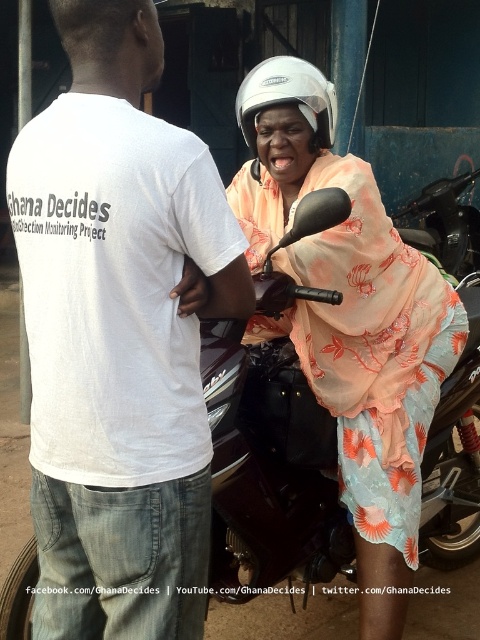
Does floral fabric helmet at upper center have a lesser width compared to white matte helmet at upper center?

In fact, floral fabric helmet at upper center might be wider than white matte helmet at upper center.

The height and width of the screenshot is (640, 480). I want to click on floral fabric helmet at upper center, so click(348, 308).

Where is `floral fabric helmet at upper center`? This screenshot has width=480, height=640. floral fabric helmet at upper center is located at coordinates [348, 308].

The width and height of the screenshot is (480, 640). I want to click on floral fabric helmet at upper center, so click(348, 308).

Who is taller, floral fabric helmet at upper center or shiny dark brown motorcycle at center?

floral fabric helmet at upper center

Is floral fabric helmet at upper center shorter than shiny dark brown motorcycle at center?

Incorrect, floral fabric helmet at upper center's height does not fall short of shiny dark brown motorcycle at center's.

Who is more forward, (259, 257) or (286, 458)?

Point (259, 257) is more forward.

The height and width of the screenshot is (640, 480). I want to click on floral fabric helmet at upper center, so click(348, 308).

Does white cotton shirt at center have a lesser width compared to white matte helmet at upper center?

No, white cotton shirt at center is not thinner than white matte helmet at upper center.

You are a GUI agent. You are given a task and a screenshot of the screen. Output one action in this format:
    pyautogui.click(x=<x>, y=<y>)
    Task: Click on the white cotton shirt at center
    The height and width of the screenshot is (640, 480).
    Given the screenshot: What is the action you would take?
    pyautogui.click(x=119, y=336)

I want to click on white cotton shirt at center, so click(x=119, y=336).